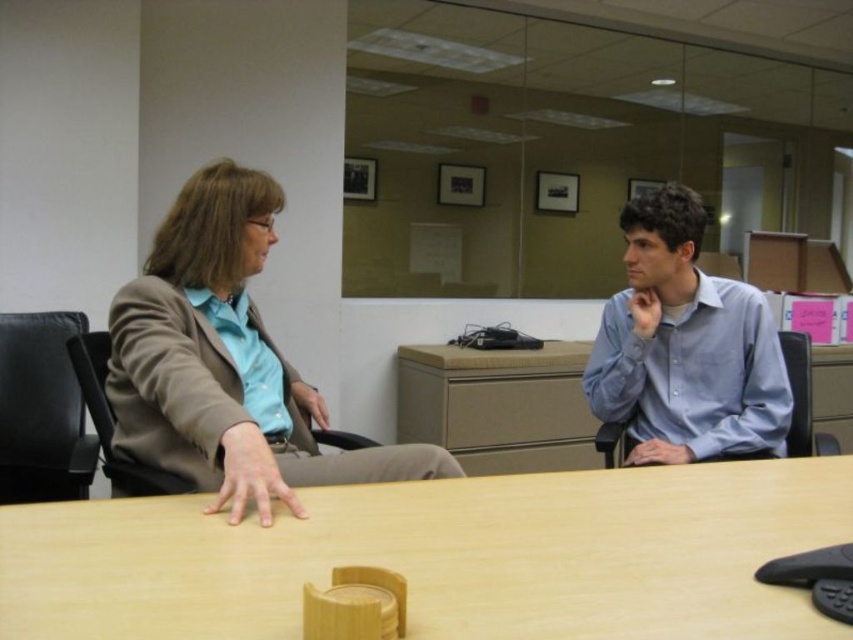
Is wooden at center shorter than matte brown blazer at left?

Indeed, wooden at center has a lesser height compared to matte brown blazer at left.

Does wooden at center appear on the right side of matte brown blazer at left?

Correct, you'll find wooden at center to the right of matte brown blazer at left.

This screenshot has width=853, height=640. Find the location of `wooden at center`. wooden at center is located at coordinates click(444, 556).

Who is more distant from viewer, (434,477) or (608,362)?

The point (608,362) is more distant.

Where is `matte brown blazer at left`? matte brown blazer at left is located at coordinates (225, 362).

From the picture: Does wooden at center appear on the right side of light blue shirt at center?

No, wooden at center is not to the right of light blue shirt at center.

Is point (473, 612) closer to viewer compared to point (686, 188)?

Yes, point (473, 612) is in front of point (686, 188).

Where is `wooden at center`? Image resolution: width=853 pixels, height=640 pixels. wooden at center is located at coordinates (444, 556).